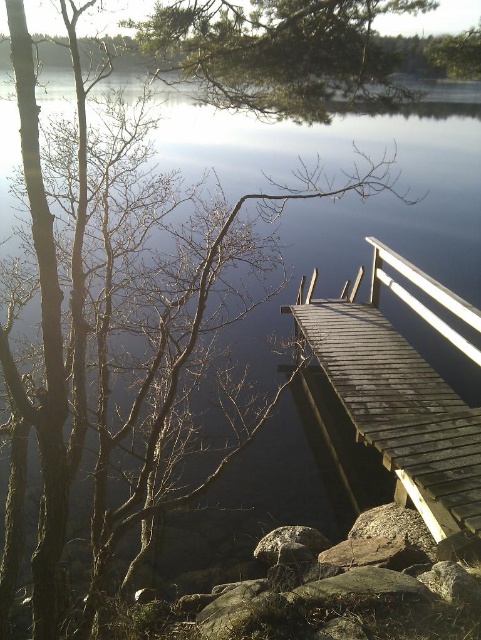
Question: Is green textured pine branch at upper center to the right of white glossy rail at upper right from the viewer's perspective?

Choices:
 (A) yes
 (B) no

Answer: (B)

Question: Can you confirm if dark brown wooden dock at right is positioned to the right of green textured pine branch at upper center?

Choices:
 (A) no
 (B) yes

Answer: (B)

Question: Which is nearer to the green textured pine branch at upper center?

Choices:
 (A) white glossy rail at upper right
 (B) dark brown wooden dock at right

Answer: (B)

Question: Which point is farther from the camera taking this photo?

Choices:
 (A) (312, 35)
 (B) (446, 506)
 (C) (465, 340)

Answer: (C)

Question: Considering the relative positions of green textured pine branch at upper center and white glossy rail at upper right in the image provided, where is green textured pine branch at upper center located with respect to white glossy rail at upper right?

Choices:
 (A) left
 (B) right

Answer: (A)

Question: Which point appears closest to the camera in this image?

Choices:
 (A) (451, 333)
 (B) (370, 307)
 (C) (253, 92)

Answer: (C)